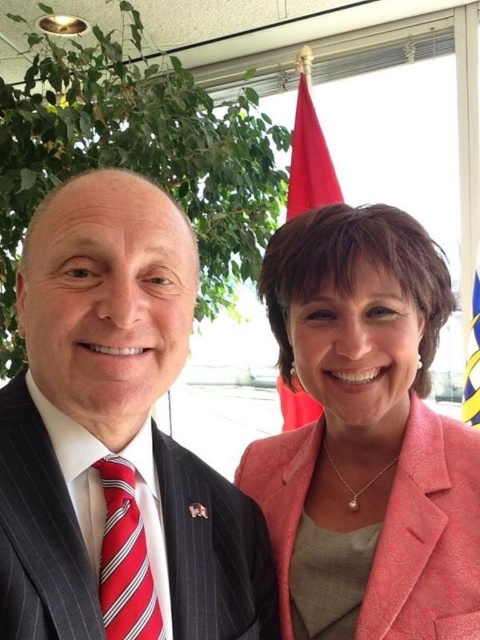
Question: Is pinstriped suit at center below red striped tie at left?

Choices:
 (A) no
 (B) yes

Answer: (A)

Question: Which of the following is the farthest from the observer?

Choices:
 (A) (299, 404)
 (B) (108, 536)
 (C) (356, 429)

Answer: (A)

Question: Can you confirm if pink textured blazer at center is positioned above red striped tie at left?

Choices:
 (A) yes
 (B) no

Answer: (A)

Question: Does red striped tie at left have a greater width compared to red fabric flag at upper center?

Choices:
 (A) no
 (B) yes

Answer: (A)

Question: Which is farther from the pinstriped suit at center?

Choices:
 (A) red fabric flag at upper center
 (B) pink textured blazer at center
 (C) red striped tie at left

Answer: (A)

Question: Which of the following is the closest to the observer?

Choices:
 (A) pinstriped suit at center
 (B) red fabric flag at upper center
 (C) pink textured blazer at center
 (D) red striped tie at left

Answer: (A)